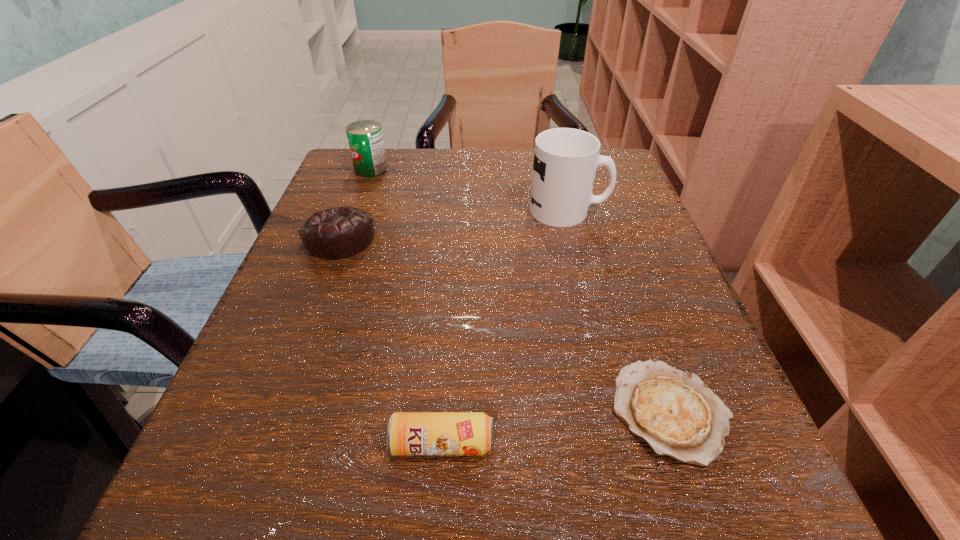
Locate which object ranks fourth in proximity to the tallest object. Please provide its 2D coordinates. Your answer should be formatted as a tuple, i.e. [(x, y)], where the tuple contains the x and y coordinates of a point satisfying the conditions above.

[(408, 433)]

In order to click on object that stands as the fourth closest to the tallest object in this screenshot , I will do `click(408, 433)`.

This screenshot has height=540, width=960. In order to click on vacant space that satisfies the following two spatial constraints: 1. on the front side of the third shortest object; 2. on the left side of the second shortest object in this screenshot , I will do `click(263, 443)`.

The height and width of the screenshot is (540, 960). I want to click on free spot that satisfies the following two spatial constraints: 1. on the front side of the quiche; 2. on the right side of the can, so click(x=284, y=411).

This screenshot has height=540, width=960. In order to click on vacant space that satisfies the following two spatial constraints: 1. on the back side of the shortest object; 2. on the right side of the beer can in this screenshot , I will do `click(444, 411)`.

Locate an element on the screen. Image resolution: width=960 pixels, height=540 pixels. free space that satisfies the following two spatial constraints: 1. on the handle side of the shortest object; 2. on the left side of the mug is located at coordinates (620, 411).

Where is `vacant position in the image that satisfies the following two spatial constraints: 1. on the handle side of the quiche; 2. on the right side of the tallest object`? The image size is (960, 540). vacant position in the image that satisfies the following two spatial constraints: 1. on the handle side of the quiche; 2. on the right side of the tallest object is located at coordinates (620, 411).

The height and width of the screenshot is (540, 960). Find the location of `vacant space that satisfies the following two spatial constraints: 1. on the front side of the quiche; 2. on the left side of the third shortest object`. vacant space that satisfies the following two spatial constraints: 1. on the front side of the quiche; 2. on the left side of the third shortest object is located at coordinates (276, 411).

At what (x,y) coordinates should I click in order to perform the action: click on vacant space that satisfies the following two spatial constraints: 1. on the handle side of the mug; 2. on the front side of the third shortest object. Please return your answer as a coordinate pair (x, y). This screenshot has height=540, width=960. Looking at the image, I should click on (575, 238).

Where is `vacant space that satisfies the following two spatial constraints: 1. on the handle side of the quiche; 2. on the left side of the tallest object`? This screenshot has height=540, width=960. vacant space that satisfies the following two spatial constraints: 1. on the handle side of the quiche; 2. on the left side of the tallest object is located at coordinates (620, 411).